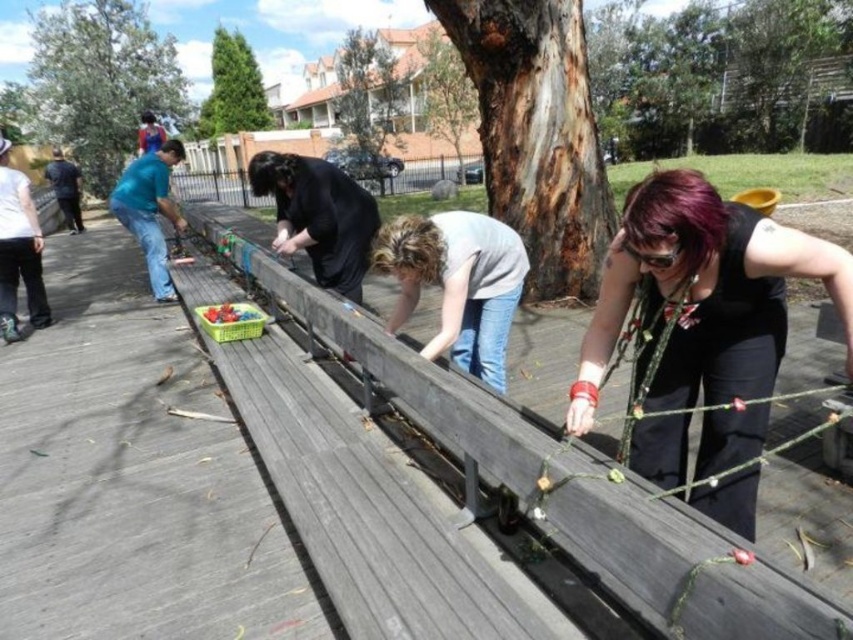
Question: Which of the following is the closest to the observer?

Choices:
 (A) (526, 444)
 (B) (35, 294)

Answer: (A)

Question: Based on their relative distances, which object is farther from the jeans at left?

Choices:
 (A) wooden rail at center
 (B) black matte shirt at center

Answer: (B)

Question: Is black matte shirt at center to the left of wooden rail at center from the viewer's perspective?

Choices:
 (A) no
 (B) yes

Answer: (A)

Question: Is wooden rail at center in front of white cotton shirt at left?

Choices:
 (A) no
 (B) yes

Answer: (B)

Question: Does white cotton shirt at left appear under jeans at left?

Choices:
 (A) yes
 (B) no

Answer: (A)

Question: Which point is closer to the camera?

Choices:
 (A) black matte shirt at center
 (B) white cotton shirt at left
 (C) wooden rail at center
 (D) jeans at left

Answer: (A)